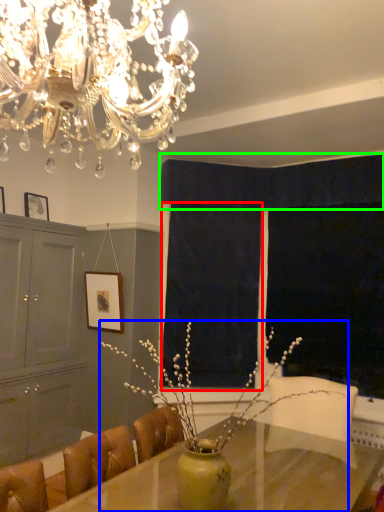
Question: Which object is positioned closest to curtain (highlighted by a red box)? Select from houseplant (highlighted by a blue box) and curtain (highlighted by a green box).

Choices:
 (A) houseplant
 (B) curtain

Answer: (A)